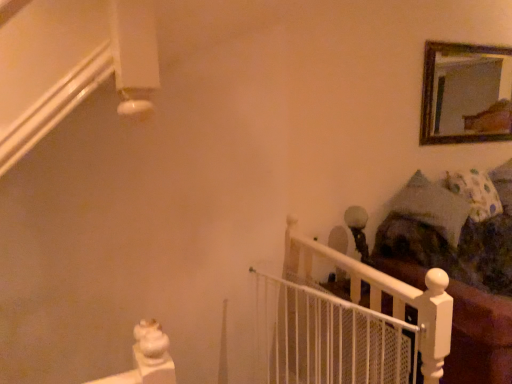
Question: Could you tell me if dark brown fabric bed at right is facing fluffy white pillow at right?

Choices:
 (A) no
 (B) yes

Answer: (A)

Question: Can you confirm if dark brown fabric bed at right is taller than fluffy white pillow at right?

Choices:
 (A) yes
 (B) no

Answer: (A)

Question: Is the surface of dark brown fabric bed at right in direct contact with fluffy white pillow at right?

Choices:
 (A) no
 (B) yes

Answer: (A)

Question: Is fluffy white pillow at right completely or partially inside dark brown fabric bed at right?

Choices:
 (A) no
 (B) yes

Answer: (A)

Question: From the image's perspective, is dark brown fabric bed at right above fluffy white pillow at right?

Choices:
 (A) yes
 (B) no

Answer: (B)

Question: From the image's perspective, is dark brown fabric bed at right positioned above or below white mesh gate at center?

Choices:
 (A) below
 (B) above

Answer: (B)

Question: Is dark brown fabric bed at right taller or shorter than white mesh gate at center?

Choices:
 (A) tall
 (B) short

Answer: (A)

Question: In the image, is dark brown fabric bed at right on the left side or the right side of white mesh gate at center?

Choices:
 (A) left
 (B) right

Answer: (B)

Question: Is dark brown fabric bed at right inside the boundaries of white mesh gate at center, or outside?

Choices:
 (A) inside
 (B) outside

Answer: (B)

Question: From a real-world perspective, is wooden-framed mirror at upper right positioned above or below dark brown fabric bed at right?

Choices:
 (A) above
 (B) below

Answer: (A)

Question: Is wooden-framed mirror at upper right wider or thinner than dark brown fabric bed at right?

Choices:
 (A) wide
 (B) thin

Answer: (B)

Question: From the image's perspective, is wooden-framed mirror at upper right positioned above or below dark brown fabric bed at right?

Choices:
 (A) above
 (B) below

Answer: (A)

Question: Considering their positions, is wooden-framed mirror at upper right located in front of or behind dark brown fabric bed at right?

Choices:
 (A) behind
 (B) front

Answer: (A)

Question: Is wooden-framed mirror at upper right in front of or behind fluffy white pillow at right in the image?

Choices:
 (A) front
 (B) behind

Answer: (B)

Question: Is wooden-framed mirror at upper right inside the boundaries of fluffy white pillow at right, or outside?

Choices:
 (A) outside
 (B) inside

Answer: (A)